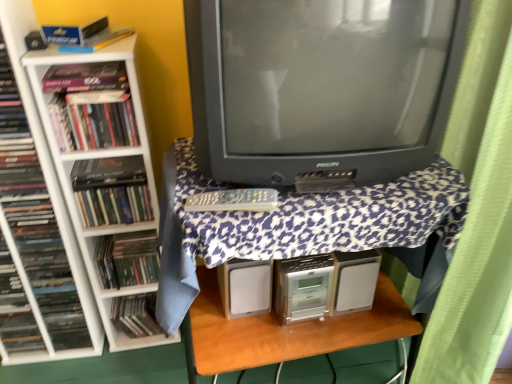
Question: Is hardcover book at left, the 6th book positioned from the right, not within white plastic bookcase at left?

Choices:
 (A) yes
 (B) no

Answer: (A)

Question: Considering the relative sizes of hardcover book at left, the 6th book positioned from the right, and white plastic bookcase at left in the image provided, is hardcover book at left, the 6th book positioned from the right, shorter than white plastic bookcase at left?

Choices:
 (A) yes
 (B) no

Answer: (B)

Question: From the image's perspective, is hardcover book at left, the 2th book in the left-to-right sequence, on white plastic bookcase at left?

Choices:
 (A) no
 (B) yes

Answer: (B)

Question: Does hardcover book at left, the 6th book positioned from the right, appear on the left side of white plastic bookcase at left?

Choices:
 (A) no
 (B) yes

Answer: (B)

Question: Considering the relative sizes of hardcover book at left, the 6th book positioned from the right, and white plastic bookcase at left in the image provided, is hardcover book at left, the 6th book positioned from the right, bigger than white plastic bookcase at left?

Choices:
 (A) no
 (B) yes

Answer: (A)

Question: Does hardcover book at left, the 6th book positioned from the right, have a greater width compared to white plastic bookcase at left?

Choices:
 (A) no
 (B) yes

Answer: (A)

Question: Can you confirm if matte black book at left, the first book when ordered from right to left, is wider than matte black book at left, the third book positioned from the right?

Choices:
 (A) yes
 (B) no

Answer: (A)

Question: Is matte black book at left, the first book when ordered from right to left, to the right of matte black book at left, the third book positioned from the right, from the viewer's perspective?

Choices:
 (A) no
 (B) yes

Answer: (B)

Question: Considering the relative sizes of matte black book at left, acting as the seventh book starting from the left, and matte black book at left, the third book positioned from the right, in the image provided, is matte black book at left, acting as the seventh book starting from the left, shorter than matte black book at left, the third book positioned from the right,?

Choices:
 (A) yes
 (B) no

Answer: (B)

Question: From a real-world perspective, is matte black book at left, acting as the seventh book starting from the left, below matte black book at left, the 5th book positioned from the left?

Choices:
 (A) yes
 (B) no

Answer: (A)

Question: Can you confirm if matte black book at left, acting as the seventh book starting from the left, is bigger than matte black book at left, the 5th book positioned from the left?

Choices:
 (A) yes
 (B) no

Answer: (A)

Question: Considering the relative sizes of matte black book at left, the first book when ordered from right to left, and matte black book at left, the third book positioned from the right, in the image provided, is matte black book at left, the first book when ordered from right to left, thinner than matte black book at left, the third book positioned from the right,?

Choices:
 (A) yes
 (B) no

Answer: (B)

Question: Is matte black book at left, the 1th book from the left, not within matte black book at left, which ranks as the 5th book in right-to-left order?

Choices:
 (A) no
 (B) yes

Answer: (B)